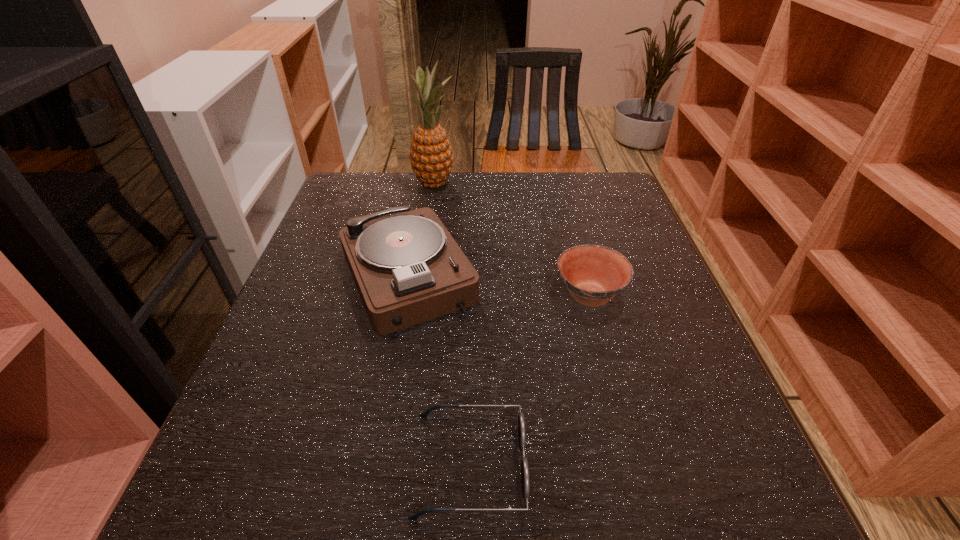
Image resolution: width=960 pixels, height=540 pixels. In order to click on vacant space that's between the nearest object and the third shortest object in this screenshot , I will do `click(439, 370)`.

You are a GUI agent. You are given a task and a screenshot of the screen. Output one action in this format:
    pyautogui.click(x=<x>, y=<y>)
    Task: Click on the free space between the third shortest object and the nearest object
    The image size is (960, 540).
    Given the screenshot: What is the action you would take?
    pyautogui.click(x=439, y=370)

The width and height of the screenshot is (960, 540). In order to click on free spot between the rightmost object and the shortest object in this screenshot , I will do `click(529, 380)`.

What are the coordinates of `free space between the shortest object and the farthest object` in the screenshot? It's located at (451, 324).

Find the location of a particular element. The width and height of the screenshot is (960, 540). free space between the bowl and the shortest object is located at coordinates (529, 380).

The height and width of the screenshot is (540, 960). I want to click on free space between the bowl and the shortest object, so click(529, 380).

Locate an element on the screen. free space between the sunglasses and the bowl is located at coordinates (529, 380).

Identify the location of vacant area that lies between the sunglasses and the farthest object. The width and height of the screenshot is (960, 540). (451, 324).

Locate an element on the screen. This screenshot has height=540, width=960. object that is the second closest to the record player is located at coordinates (431, 158).

Where is `the second closest object relative to the rightmost object`? This screenshot has height=540, width=960. the second closest object relative to the rightmost object is located at coordinates (521, 421).